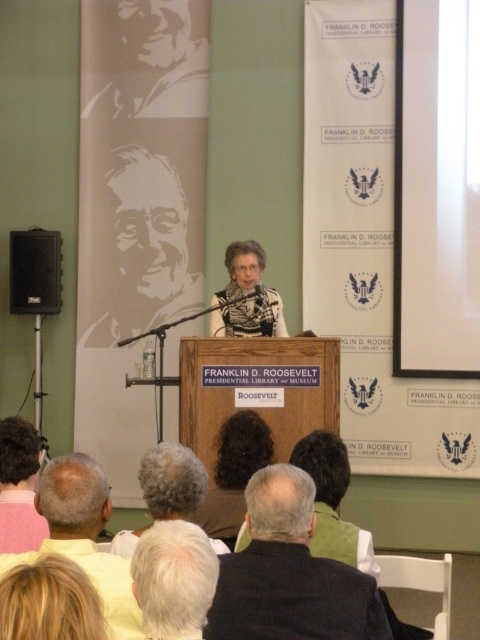
Question: Does silhouette paper portrait at upper left have a lesser width compared to gray hair at center?

Choices:
 (A) no
 (B) yes

Answer: (A)

Question: Which object appears farthest from the camera in this image?

Choices:
 (A) dark brown hair at center
 (B) silhouette paper portrait at upper left
 (C) dark gray hair at center

Answer: (B)

Question: Which point is closer to the camera taking this photo?

Choices:
 (A) (84, 333)
 (B) (39, 506)
 (C) (39, 314)
 (D) (2, 552)

Answer: (B)

Question: Can you confirm if gray matte portrait at upper left is positioned above dark gray hair at center?

Choices:
 (A) no
 (B) yes

Answer: (B)

Question: Which point is closer to the camera?

Choices:
 (A) gray matte portrait at upper left
 (B) dark gray suit at center

Answer: (B)

Question: Is silhouette paper portrait at upper left to the left of gray hair at center from the viewer's perspective?

Choices:
 (A) no
 (B) yes

Answer: (B)